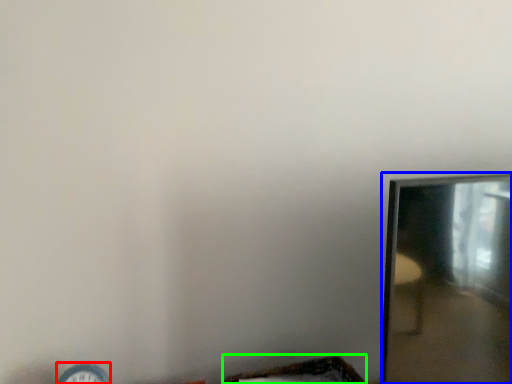
Question: Estimate the real-world distances between objects in this image. Which object is farther from clock (highlighted by a red box), mirror (highlighted by a blue box) or basket (highlighted by a green box)?

Choices:
 (A) mirror
 (B) basket

Answer: (A)